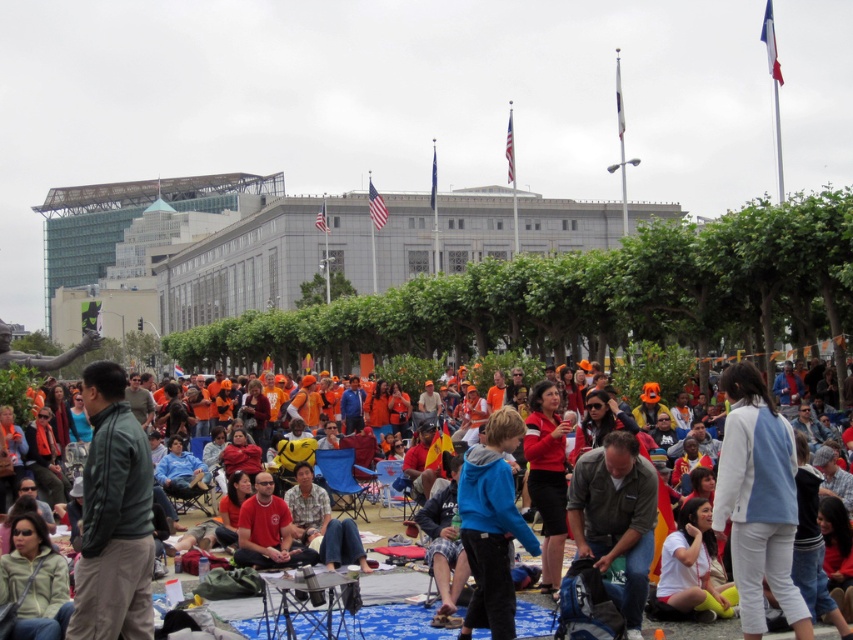
You are a photographer at the event and want to capture both the green matte jacket at lower left and the blue fleece jacket at center in a single photo. Which jacket should you focus on to ensure both are in frame without needing to adjust your camera angle?

The green matte jacket at lower left is taller than the blue fleece jacket at center, so focusing on the taller green matte jacket at lower left will ensure both are visible in the frame without needing to adjust the camera angle.

You are organizing a photo shoot and need to ensure that the green matte jacket at lower left and the blue fleece jacket at center are visible in the frame. Given their sizes, which jacket might require more space in the composition to be fully captured?

The green matte jacket at lower left is bigger than the blue fleece jacket at center, so it would require more space in the composition to be fully captured.